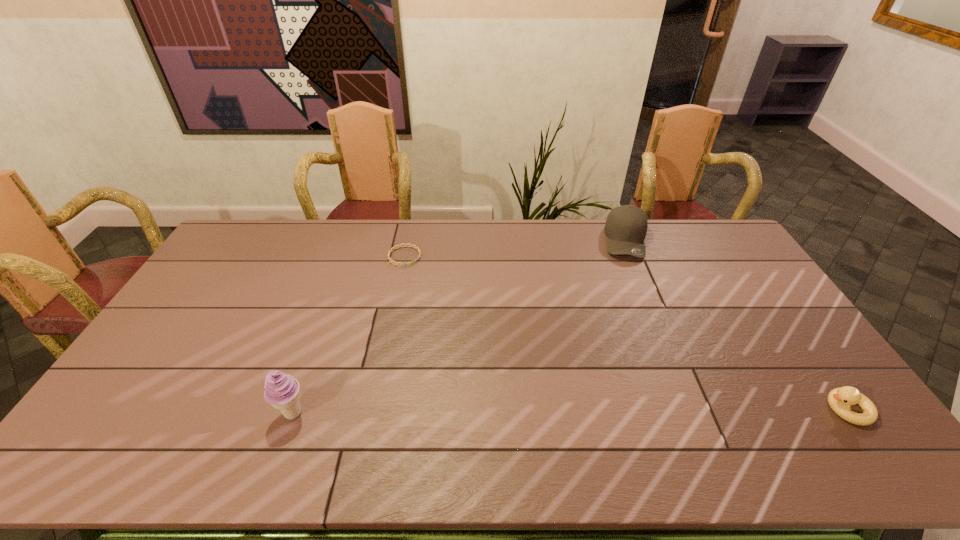
At what (x,y) coordinates should I click in order to perform the action: click on the tallest object. Please return your answer as a coordinate pair (x, y). This screenshot has height=540, width=960. Looking at the image, I should click on point(282,391).

This screenshot has height=540, width=960. Identify the location of icecream. (282, 391).

You are a GUI agent. You are given a task and a screenshot of the screen. Output one action in this format:
    pyautogui.click(x=<x>, y=<y>)
    Task: Click on the duckling
    The height and width of the screenshot is (540, 960).
    Given the screenshot: What is the action you would take?
    pyautogui.click(x=840, y=399)

Where is `the second shortest object`? This screenshot has width=960, height=540. the second shortest object is located at coordinates (840, 399).

What are the coordinates of `baseball cap` in the screenshot? It's located at (626, 226).

You are a GUI agent. You are given a task and a screenshot of the screen. Output one action in this format:
    pyautogui.click(x=<x>, y=<y>)
    Task: Click on the third shortest object
    
    Given the screenshot: What is the action you would take?
    pyautogui.click(x=626, y=226)

Find the location of `bracelet`. bracelet is located at coordinates (394, 248).

Find the location of a particular element. The height and width of the screenshot is (540, 960). the third object from right to left is located at coordinates (394, 248).

Locate an element on the screen. free space located 0.380m on the right of the tallest object is located at coordinates (458, 413).

In order to click on free space located at the beak of the rightmost object in this screenshot , I will do `click(780, 409)`.